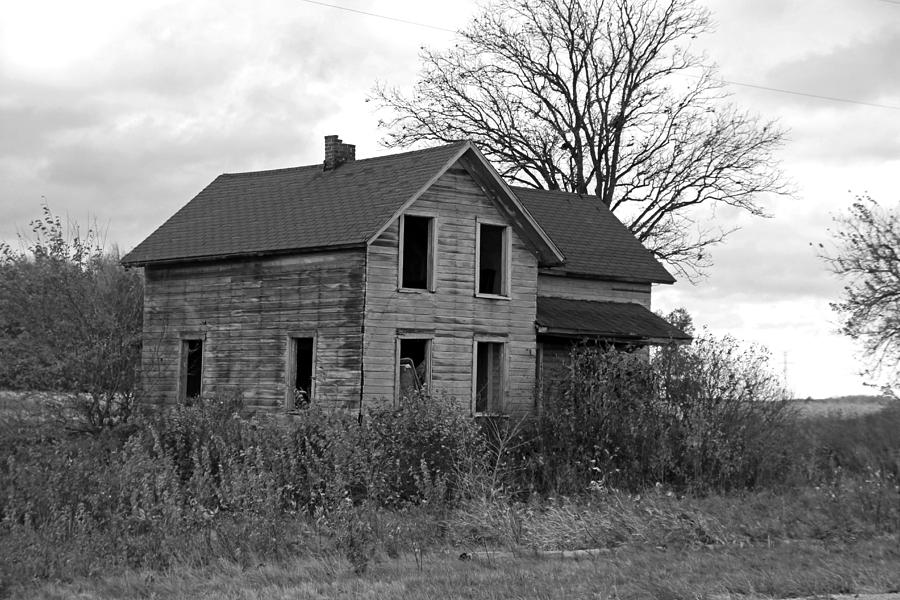
The image size is (900, 600). In order to click on chimney in this screenshot , I will do `click(346, 155)`.